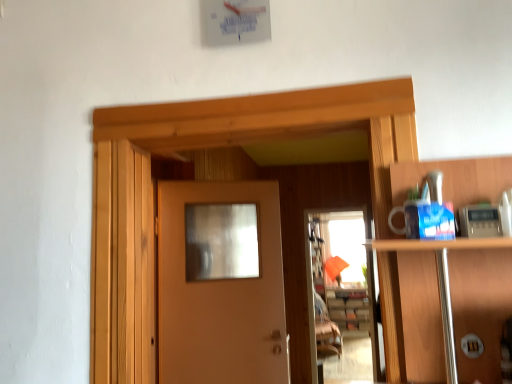
This screenshot has height=384, width=512. What do you see at coordinates (343, 294) in the screenshot?
I see `translucent glass screen door at center` at bounding box center [343, 294].

At what (x,y) coordinates should I click in order to perform the action: click on matte wood door at center. Please return your answer as a coordinate pair (x, y). The image size is (512, 384). Looking at the image, I should click on (220, 290).

From the picture: Is translucent glass screen door at center facing towards matte wood door at center?

Yes, translucent glass screen door at center is oriented towards matte wood door at center.

Image resolution: width=512 pixels, height=384 pixels. In the image, there is a matte wood door at center. What are the coordinates of `screen door below it (from the image's perspective)` in the screenshot? It's located at (343, 294).

From the image's perspective, who appears lower, translucent glass screen door at center or matte wood door at center?

translucent glass screen door at center.

Is matte wood door at center aimed at translucent glass screen door at center?

No, matte wood door at center is not turned towards translucent glass screen door at center.

Which of these two, matte wood door at center or translucent glass screen door at center, is smaller?

Smaller between the two is matte wood door at center.

Between matte wood door at center and translucent glass screen door at center, which one has smaller width?

matte wood door at center is thinner.

From the image's perspective, is wooden cabinet at center below translucent glass screen door at center?

Yes.

Consider the image. Which is more to the right, wooden cabinet at center or translucent glass screen door at center?

wooden cabinet at center is more to the right.

From a real-world perspective, who is located lower, wooden cabinet at center or translucent glass screen door at center?

In real-world perspective, wooden cabinet at center is lower.

Could you tell me if wooden cabinet at center is turned towards matte wood door at center?

Yes, wooden cabinet at center is turned towards matte wood door at center.

From a real-world perspective, is wooden cabinet at center positioned above or below matte wood door at center?

From a real-world perspective, wooden cabinet at center is physically below matte wood door at center.

From the image's perspective, is wooden cabinet at center located beneath matte wood door at center?

Correct, wooden cabinet at center appears lower than matte wood door at center in the image.

Is matte wood door at center inside wooden cabinet at center?

No, matte wood door at center is located outside of wooden cabinet at center.

Does point (347, 322) come farther from viewer compared to point (368, 317)?

No, it is in front of (368, 317).

Measure the distance between translucent glass screen door at center and wooden cabinet at center.

The distance of translucent glass screen door at center from wooden cabinet at center is 26.68 centimeters.

From the picture: Is translucent glass screen door at center spatially inside wooden cabinet at center, or outside of it?

translucent glass screen door at center exists outside the volume of wooden cabinet at center.

Is matte wood door at center beside wooden cabinet at center?

No, matte wood door at center is not beside wooden cabinet at center.

Between matte wood door at center and wooden cabinet at center, which one is positioned behind?

wooden cabinet at center is further away from the camera.

How different are the orientations of matte wood door at center and wooden cabinet at center in degrees?

28.5 degrees separate the facing orientations of matte wood door at center and wooden cabinet at center.

Is matte wood door at center at the left side of wooden cabinet at center?

Indeed, matte wood door at center is positioned on the left side of wooden cabinet at center.

Image resolution: width=512 pixels, height=384 pixels. What are the coordinates of `screen door behind the matte wood door at center` in the screenshot? It's located at (343, 294).

Identify the location of screen door below the matte wood door at center (from the image's perspective). (343, 294).

From the picture: Estimate the real-world distances between objects in this image. Which object is closer to matte wood door at center, wooden cabinet at center or translucent glass screen door at center?

The object closer to matte wood door at center is translucent glass screen door at center.

Consider the image. Estimate the real-world distances between objects in this image. Which object is further from wooden cabinet at center, translucent glass screen door at center or matte wood door at center?

Based on the image, matte wood door at center appears to be further to wooden cabinet at center.

Considering their positions, is matte wood door at center positioned closer to translucent glass screen door at center than wooden cabinet at center?

wooden cabinet at center is positioned closer to the anchor translucent glass screen door at center.

From the image, which object appears to be farther from wooden cabinet at center, matte wood door at center or translucent glass screen door at center?

Based on the image, matte wood door at center appears to be further to wooden cabinet at center.

From the image, which object appears to be nearer to translucent glass screen door at center, wooden cabinet at center or matte wood door at center?

wooden cabinet at center lies closer to translucent glass screen door at center than the other object.

Estimate the real-world distances between objects in this image. Which object is closer to matte wood door at center, translucent glass screen door at center or wooden cabinet at center?

Among the two, translucent glass screen door at center is located nearer to matte wood door at center.

I want to click on screen door located between matte wood door at center and wooden cabinet at center in the depth direction, so [343, 294].